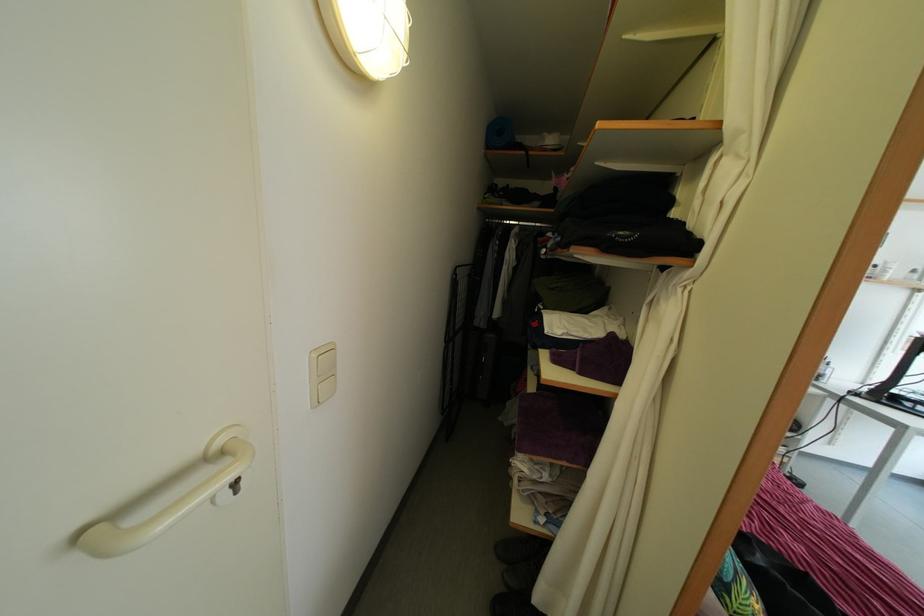
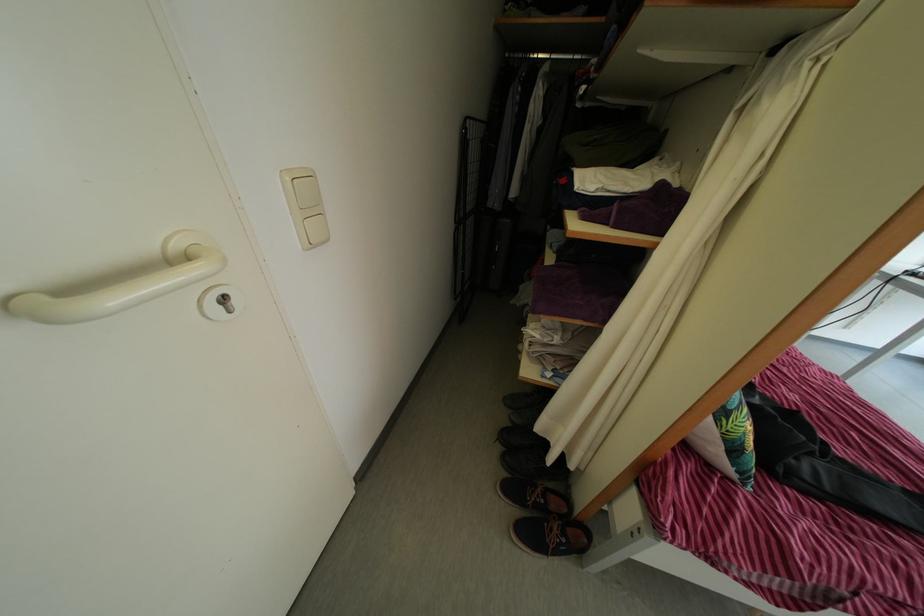
The point at (321, 363) is marked in the first image. Where is the corresponding point in the second image?

(295, 187)